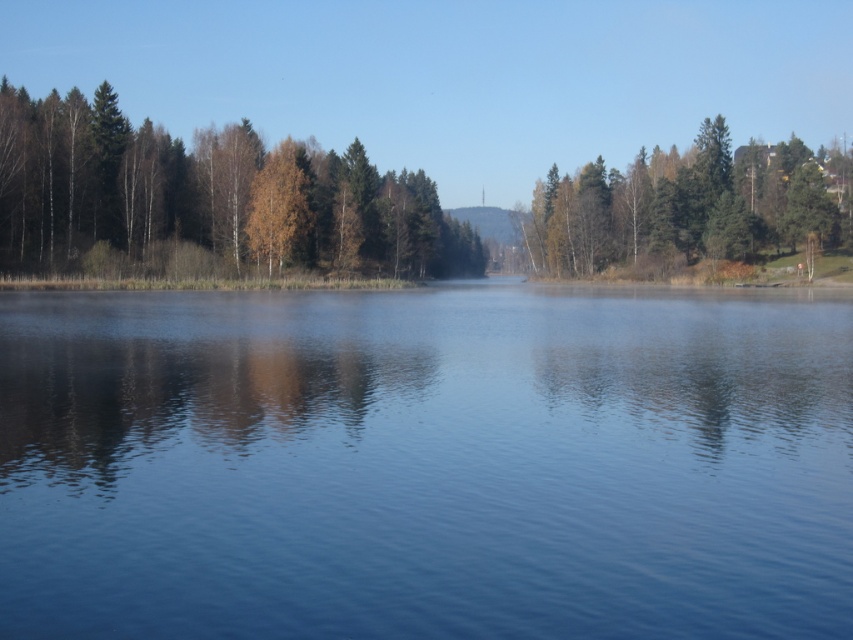
You are a kayaker planning to paddle from the transparent water at center to the green matte tree at upper right. Given that your kayak can only travel 200 feet before needing to rest, will you need to stop for a break before reaching your destination?

The distance between the transparent water at center and the green matte tree at upper right is 259.01 feet, which exceeds the kayak travel limit of 200 feet. Therefore, you will need to stop for a break before reaching the green matte tree at upper right.

You are an environmental scientist assessing the health of the trees in this landscape. You observe the brown textured trees at left and the green matte tree at upper right. Which tree would you prioritize for further inspection based on their size and potential health indicators?

The brown textured trees at left are smaller than the green matte tree at upper right. Since smaller trees might require more attention for health issues, the brown textured trees at left should be prioritized for inspection.

You are standing at the edge of the water and want to walk towards the green matte tree at upper right. Which direction should you head to first to get closer to it, considering the brown textured trees at left are in your way?

Since the brown textured trees at left are closer to the viewer than the green matte tree at upper right, you should move around them to the right side to reach the green matte tree at upper right.